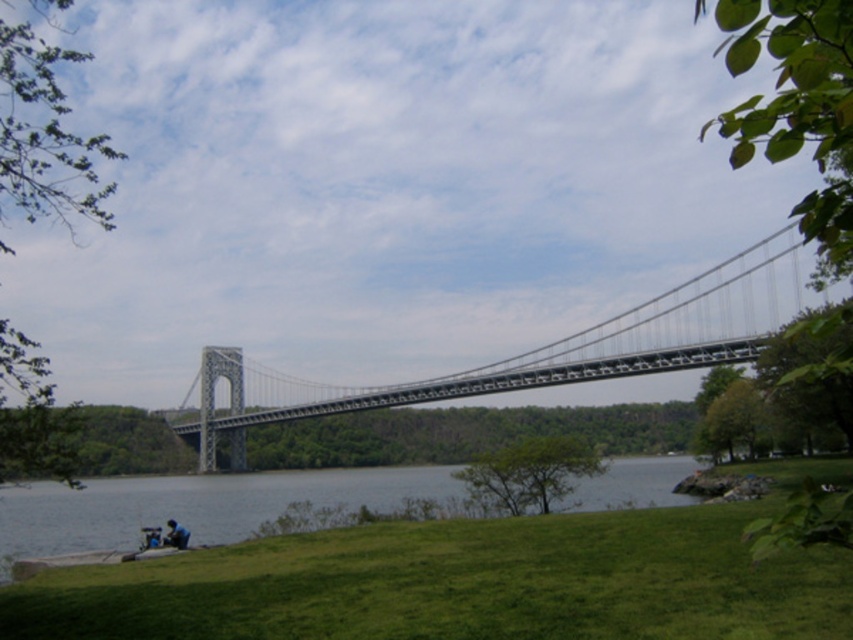
Is gray metallic suspension bridge at center shorter than blue denim jacket at lower left?

No, gray metallic suspension bridge at center is not shorter than blue denim jacket at lower left.

Is gray metallic suspension bridge at center above blue denim jacket at lower left?

Correct, gray metallic suspension bridge at center is located above blue denim jacket at lower left.

Is point (457, 392) positioned after point (144, 548)?

Yes, point (457, 392) is farther from viewer.

This screenshot has width=853, height=640. I want to click on gray metallic suspension bridge at center, so click(x=549, y=348).

Looking at this image, does gray metallic suspension bridge at center have a smaller size compared to gray concrete water at lower center?

No, gray metallic suspension bridge at center is not smaller than gray concrete water at lower center.

Is gray metallic suspension bridge at center thinner than gray concrete water at lower center?

Yes.

The image size is (853, 640). Describe the element at coordinates (549, 348) in the screenshot. I see `gray metallic suspension bridge at center` at that location.

The image size is (853, 640). I want to click on gray metallic suspension bridge at center, so click(x=549, y=348).

Between green grassy at lower center and gray metallic suspension bridge at center, which one is positioned higher?

green grassy at lower center

Between point (370, 525) and point (750, 349), which one is positioned behind?

The point (750, 349) is more distant.

At what (x,y) coordinates should I click in order to perform the action: click on green grassy at lower center. Please return your answer as a coordinate pair (x, y). Looking at the image, I should click on (460, 584).